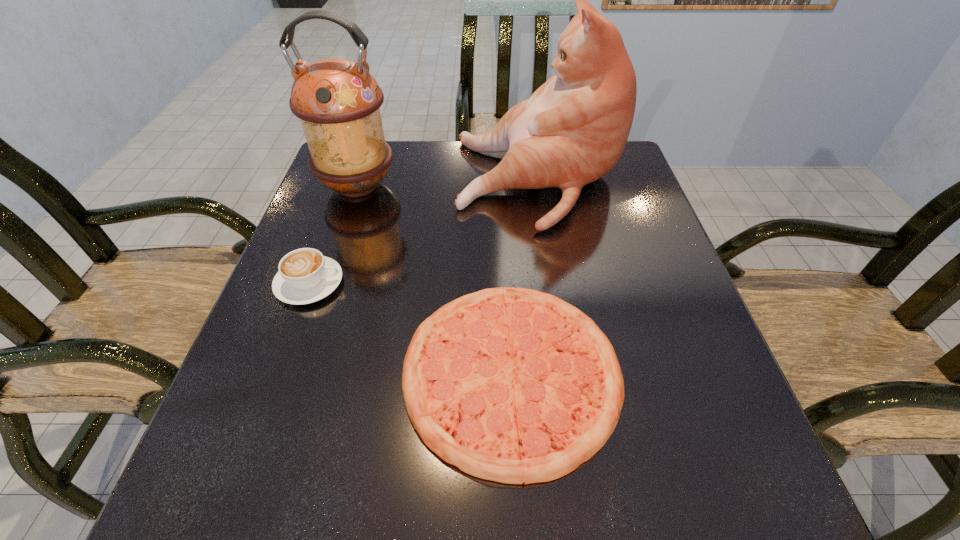
Where is `cat that is at the far edge`? Image resolution: width=960 pixels, height=540 pixels. cat that is at the far edge is located at coordinates (572, 131).

I want to click on oil lamp positioned at the far edge, so click(338, 101).

You are a GUI agent. You are given a task and a screenshot of the screen. Output one action in this format:
    pyautogui.click(x=<x>, y=<y>)
    Task: Click on the object present at the near edge
    This screenshot has width=960, height=540.
    Given the screenshot: What is the action you would take?
    pyautogui.click(x=513, y=385)

You are a GUI agent. You are given a task and a screenshot of the screen. Output one action in this format:
    pyautogui.click(x=<x>, y=<y>)
    Task: Click on the oil lamp present at the left edge
    
    Given the screenshot: What is the action you would take?
    pyautogui.click(x=338, y=101)

At what (x,y) coordinates should I click in order to perform the action: click on cappuccino positioned at the left edge. Please return your answer as a coordinate pair (x, y). Image resolution: width=960 pixels, height=540 pixels. Looking at the image, I should click on (305, 276).

The image size is (960, 540). Identify the location of object located at the right edge. point(572,131).

Image resolution: width=960 pixels, height=540 pixels. Identify the location of object at the far left corner. (338, 101).

Find the location of `object that is positioned at the far right corner`. object that is positioned at the far right corner is located at coordinates (572, 131).

I want to click on vacant area at the far edge of the desktop, so click(398, 160).

I want to click on vacant space at the near edge, so click(569, 495).